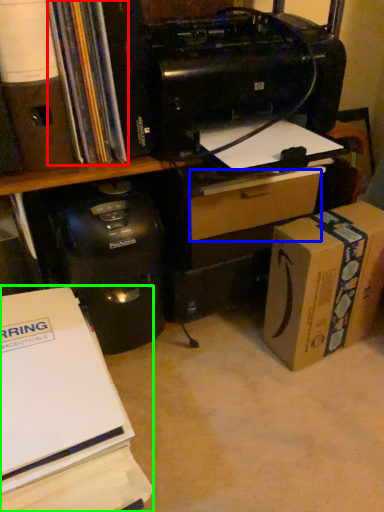
Question: Based on their relative distances, which object is farther from book (highlighted by a red box)? Choose from drawer (highlighted by a blue box) and office supplies (highlighted by a green box).

Choices:
 (A) drawer
 (B) office supplies

Answer: (B)